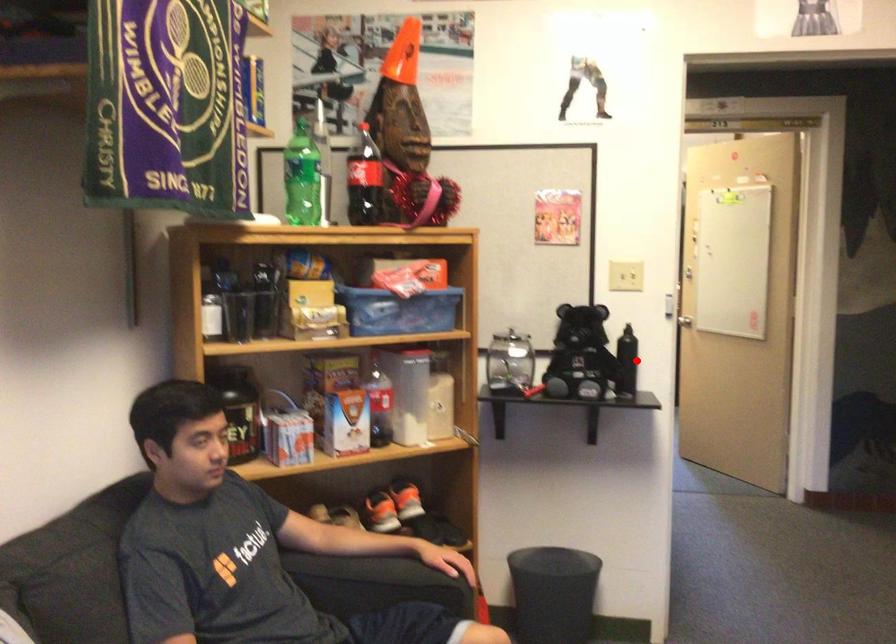
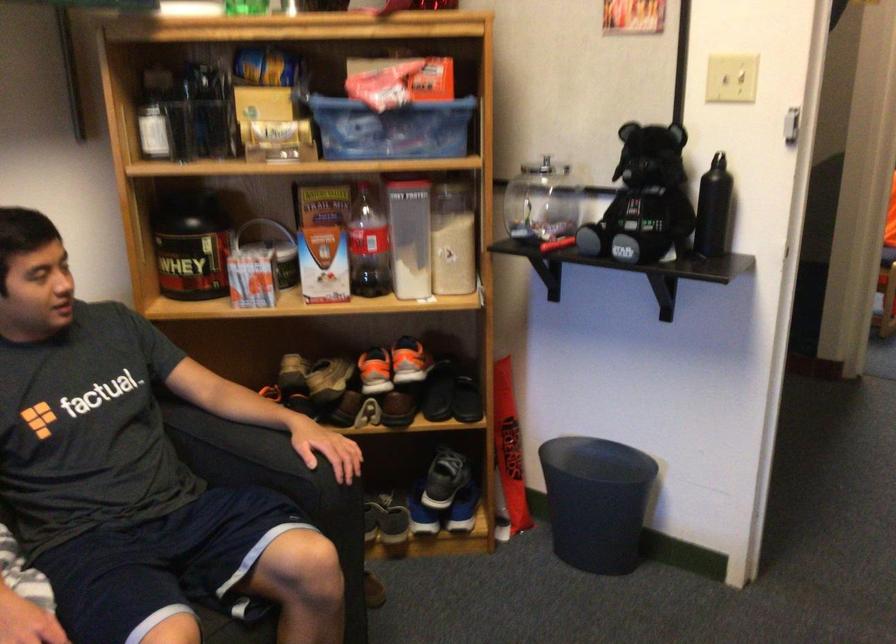
Question: I am providing you with two images of the same scene from different viewpoints. Image1 has a red point marked. In image2, the corresponding 3D location appears at what relative position? Reply with the corresponding letter.

Choices:
 (A) Closer
 (B) Farther

Answer: (A)